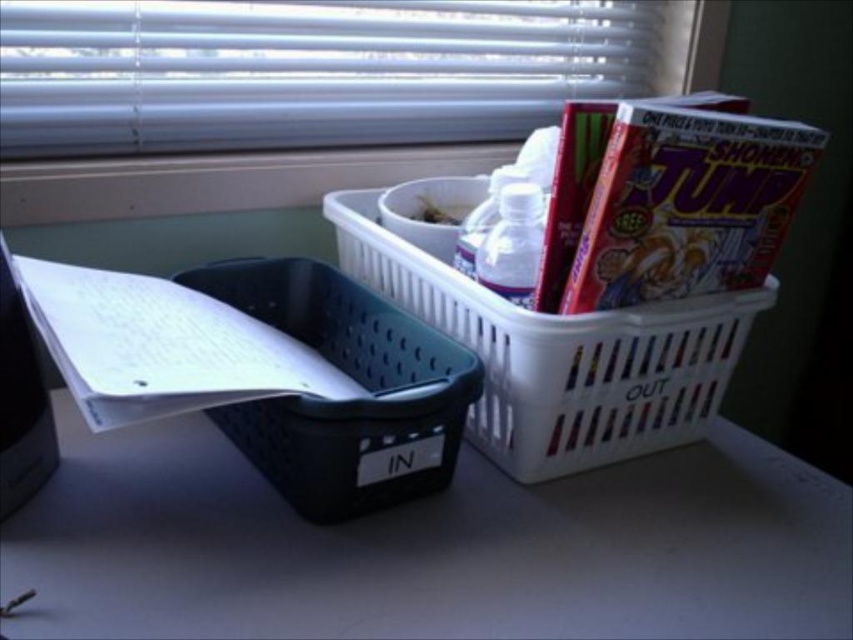
Question: Can you confirm if black plastic table at lower center is positioned to the left of black plastic basket at left?

Choices:
 (A) yes
 (B) no

Answer: (B)

Question: Which object appears farthest from the camera in this image?

Choices:
 (A) white paper at left
 (B) white plastic blinds at upper center

Answer: (B)

Question: Can you confirm if black plastic table at lower center is positioned below white plastic blinds at upper center?

Choices:
 (A) yes
 (B) no

Answer: (A)

Question: Can you confirm if black plastic table at lower center is bigger than white plastic basket at upper right?

Choices:
 (A) no
 (B) yes

Answer: (A)

Question: Which point appears closest to the camera in this image?

Choices:
 (A) (148, 369)
 (B) (334, 515)
 (C) (689, 605)

Answer: (A)

Question: Estimate the real-world distances between objects in this image. Which object is farther from the white paper at left?

Choices:
 (A) white plastic basket at upper right
 (B) white plastic blinds at upper center
 (C) black plastic table at lower center

Answer: (B)